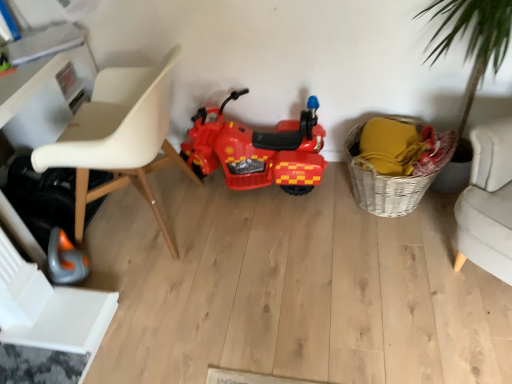
In order to click on free space to the right of white plastic swivel chair at lower left in this screenshot , I will do `click(148, 319)`.